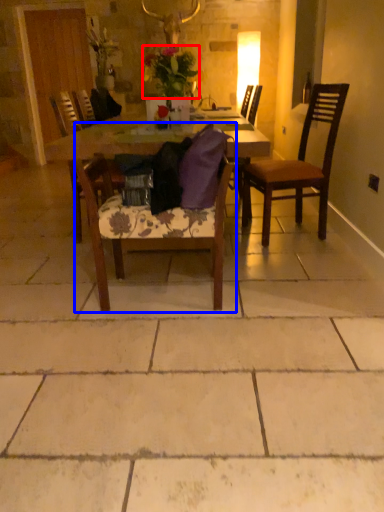
Question: Which point is closer to the camera, flower (highlighted by a red box) or chair (highlighted by a blue box)?

Choices:
 (A) flower
 (B) chair

Answer: (B)